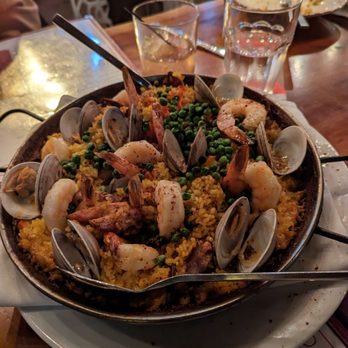
Where is `plate`? This screenshot has width=348, height=348. plate is located at coordinates (65, 332).